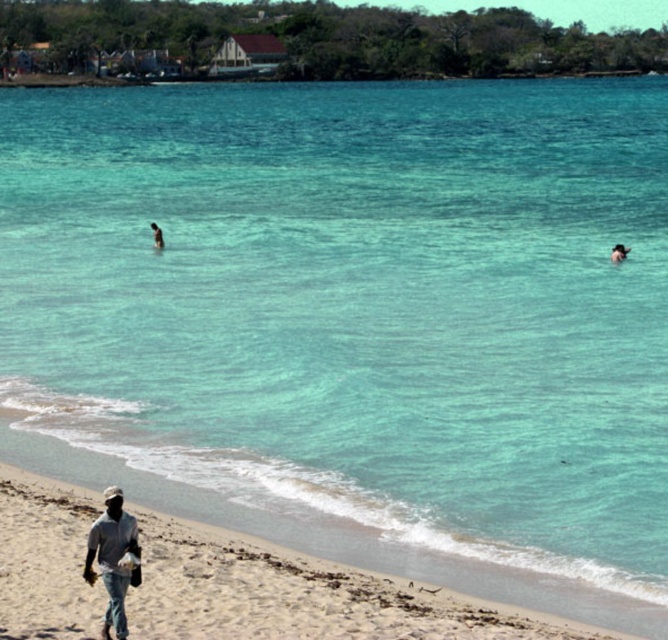
You are standing on the beach and want to call out to both the smooth skin person at upper right and the dark skin human at center. Which one would you need to shout louder to be heard?

You would need to shout louder to reach the dark skin human at center because they are further away from you compared to the smooth skin person at upper right who is closer.

You are a photographer trying to capture a group photo of the gray matte shirt at lower left and the dark skin human at center. Which person should you position closer to the camera to ensure they appear the same size in the photo?

Since the gray matte shirt at lower left is wider than the dark skin human at center, you should position the dark skin human at center closer to the camera to make them appear the same size in the photo.

Based on the photo, you are a lifeguard on duty and you need to locate the smooth skin person at upper right. What are their coordinates?

The smooth skin person at upper right is located at coordinates point (619, 252).